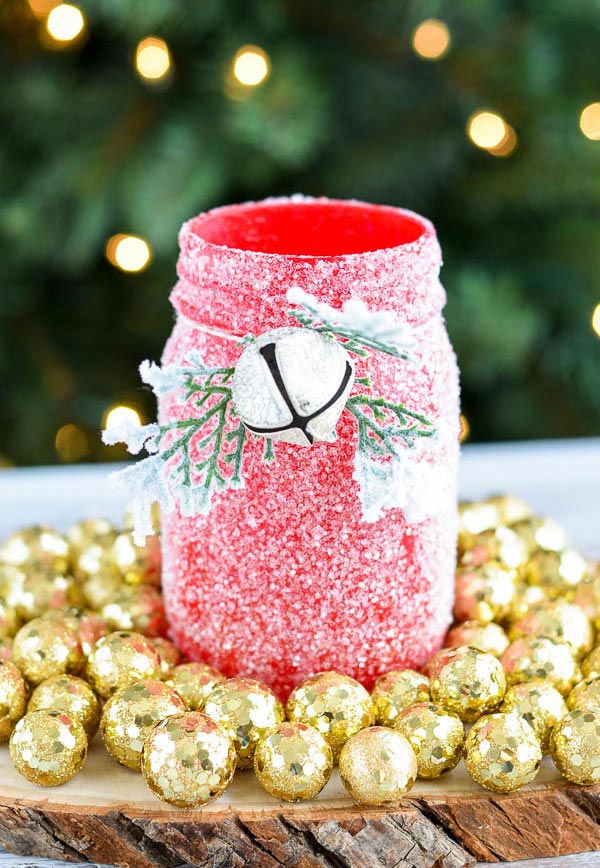
Identify the location of white fabric tablecloth. This screenshot has height=868, width=600. (536, 475), (20, 862), (584, 862), (55, 494).